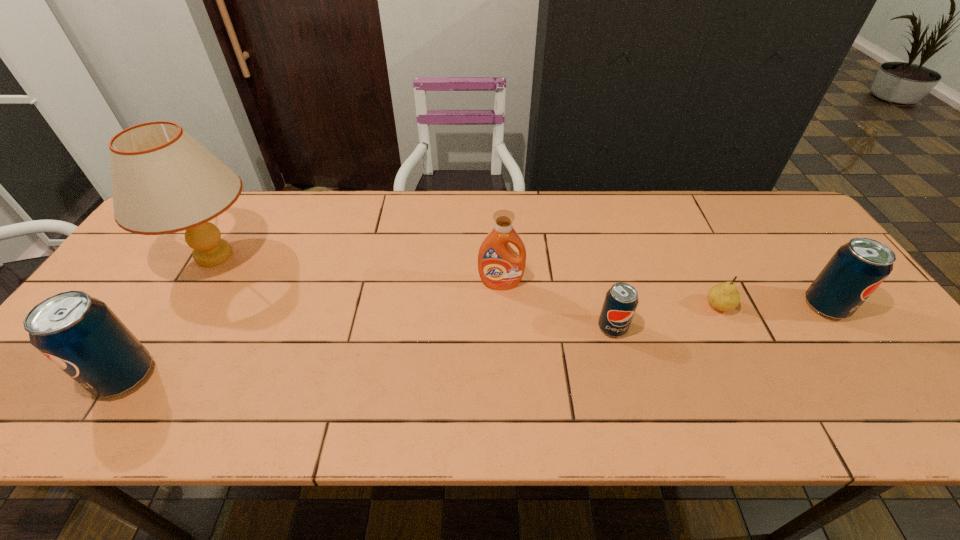
Where is `free space located 0.230m on the right of the leftmost soda can`? The height and width of the screenshot is (540, 960). free space located 0.230m on the right of the leftmost soda can is located at coordinates coord(256,376).

This screenshot has width=960, height=540. What are the coordinates of `vacant space located 0.220m on the left of the third object from right to left` in the screenshot? It's located at (508, 328).

You are a GUI agent. You are given a task and a screenshot of the screen. Output one action in this format:
    pyautogui.click(x=<x>, y=<y>)
    Task: Click on the free space located 0.200m on the left of the rightmost soda can
    The image size is (960, 540).
    Given the screenshot: What is the action you would take?
    pyautogui.click(x=726, y=306)

Where is `vacant space situated on the left of the fifth object from left to right`? vacant space situated on the left of the fifth object from left to right is located at coordinates (646, 306).

This screenshot has width=960, height=540. What are the coordinates of `vacant space located 0.280m on the front of the tallest object` in the screenshot? It's located at (132, 389).

Locate an element on the screen. free region located on the front-facing side of the detergent is located at coordinates (502, 314).

Find the location of a particular element. The image size is (960, 540). object located at the far edge is located at coordinates (164, 181).

This screenshot has width=960, height=540. I want to click on object that is at the near edge, so click(80, 334).

Where is `soda can that is at the left edge`? This screenshot has height=540, width=960. soda can that is at the left edge is located at coordinates (80, 334).

The image size is (960, 540). Identify the location of lampshade that is at the left edge. (164, 181).